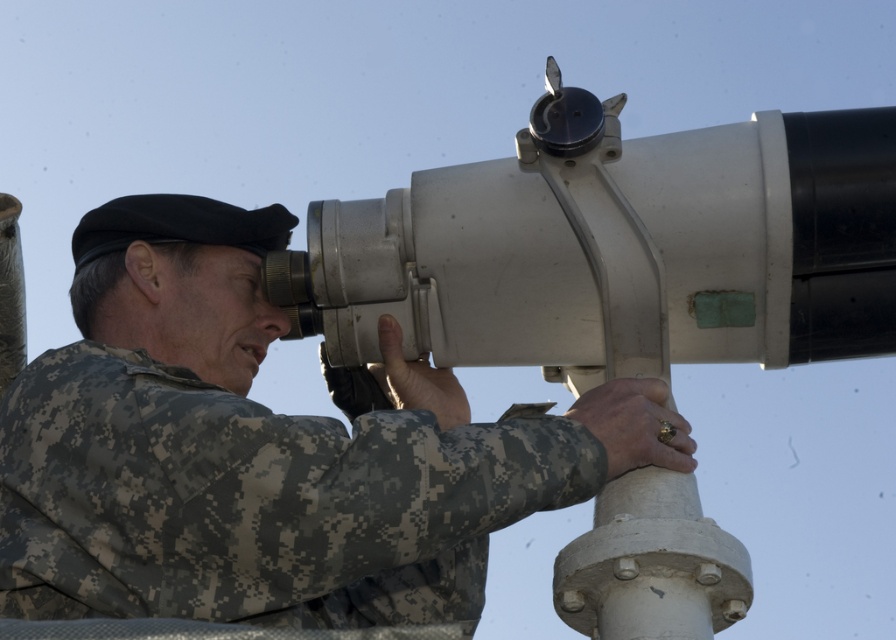
Question: Does matte gray binoculars at center have a smaller size compared to metallic/smooth telescope at upper center?

Choices:
 (A) no
 (B) yes

Answer: (A)

Question: Which object is farther from the camera taking this photo?

Choices:
 (A) matte gray binoculars at center
 (B) metallic/smooth telescope at upper center

Answer: (B)

Question: Is matte gray binoculars at center below metallic/smooth telescope at upper center?

Choices:
 (A) yes
 (B) no

Answer: (A)

Question: Which of the following is the closest to the observer?

Choices:
 (A) [x=84, y=243]
 (B) [x=737, y=260]

Answer: (B)

Question: Is matte gray binoculars at center above metallic/smooth telescope at upper center?

Choices:
 (A) yes
 (B) no

Answer: (B)